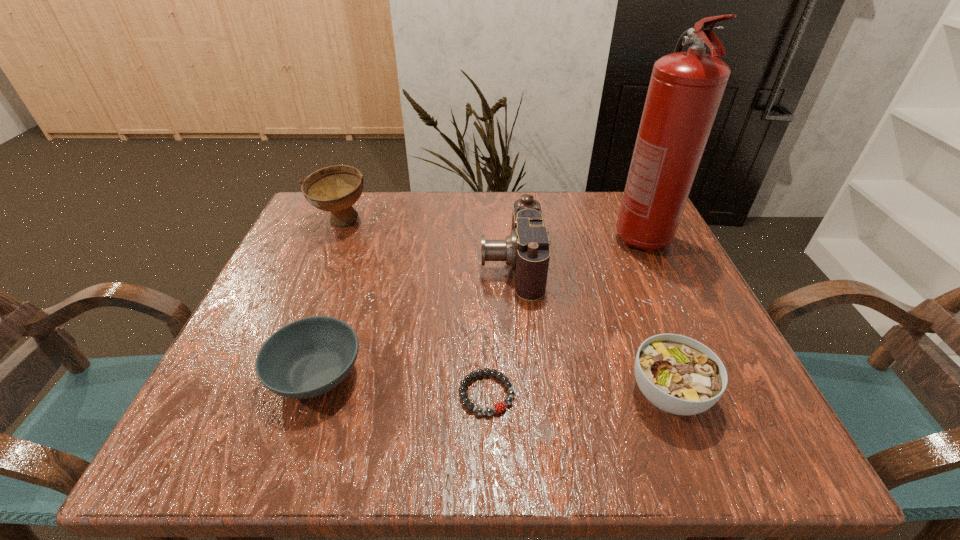
Identify the location of soup bowl that is at the right edge. (679, 375).

Identify the location of object that is at the far left corner. The width and height of the screenshot is (960, 540). (334, 189).

This screenshot has height=540, width=960. What are the coordinates of `object that is at the near left corner` in the screenshot? It's located at (309, 357).

Find the location of a particular element. object present at the far right corner is located at coordinates (686, 88).

This screenshot has width=960, height=540. What are the coordinates of `object that is at the near right corner` in the screenshot? It's located at (679, 375).

Locate an element on the screen. blank area at the far edge is located at coordinates (413, 199).

Identify the location of free space at the near edge of the desktop. (542, 414).

The width and height of the screenshot is (960, 540). I want to click on blank space at the right edge of the desktop, so click(714, 338).

You are a GUI agent. You are given a task and a screenshot of the screen. Output one action in this format:
    pyautogui.click(x=<x>, y=<y>)
    Task: Click on the free space at the far left corner of the desktop
    The width and height of the screenshot is (960, 540).
    Given the screenshot: What is the action you would take?
    pyautogui.click(x=300, y=245)

Image resolution: width=960 pixels, height=540 pixels. In the image, there is a desktop. Find the location of `free region at the far right corner`. free region at the far right corner is located at coordinates (596, 213).